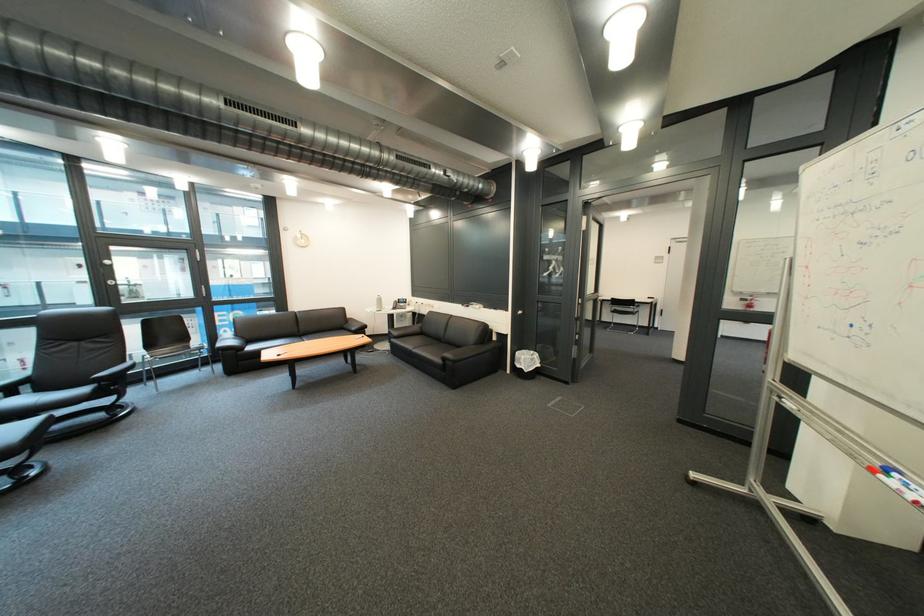
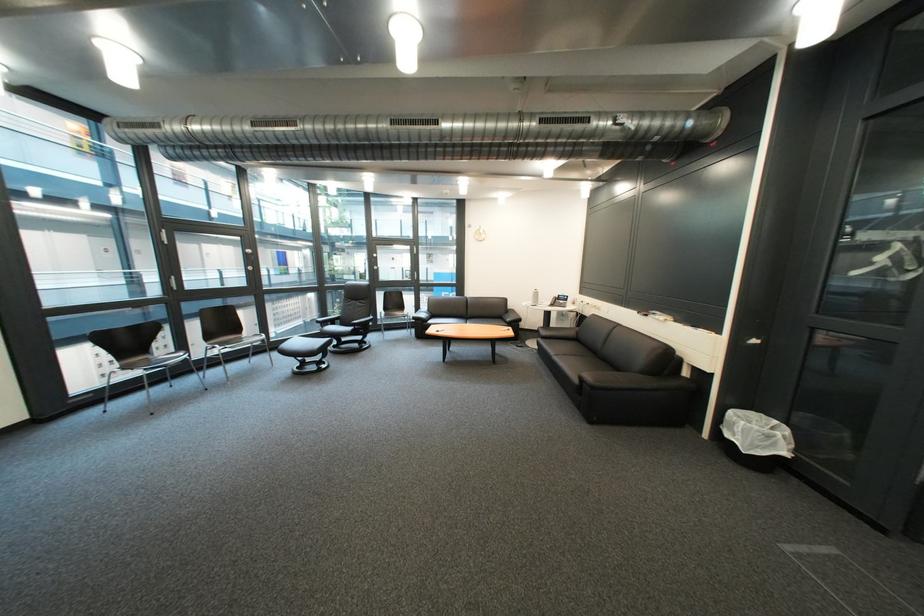
In the second image, find the point that corresponds to [457,361] in the first image.

(594, 381)